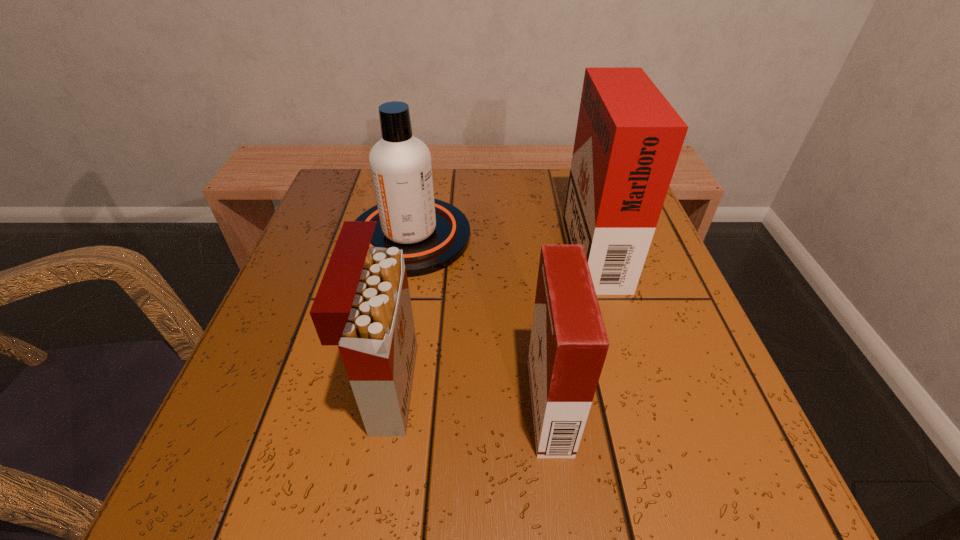
In the image, there is a desktop. Identify the location of vacant region at the far edge. (499, 168).

Where is `vacant area at the near edge`? vacant area at the near edge is located at coordinates (402, 465).

You are a GUI agent. You are given a task and a screenshot of the screen. Output one action in this format:
    pyautogui.click(x=<x>, y=<y>)
    Task: Click on the free location at the left edge of the desktop
    
    Given the screenshot: What is the action you would take?
    pyautogui.click(x=302, y=345)

Identify the location of blank space at the right edge of the desktop. This screenshot has width=960, height=540. point(689,319).

Locate an element on the screen. The height and width of the screenshot is (540, 960). free space at the far left corner is located at coordinates (347, 191).

You are a GUI agent. You are given a task and a screenshot of the screen. Output one action in this format:
    pyautogui.click(x=<x>, y=<y>)
    Task: Click on the vacant area at the near right corner
    This screenshot has height=540, width=960.
    Given the screenshot: What is the action you would take?
    pyautogui.click(x=703, y=502)

Where is `vacant area between the tallest cigarette_case and the cleansing agent`? Image resolution: width=960 pixels, height=540 pixels. vacant area between the tallest cigarette_case and the cleansing agent is located at coordinates (501, 240).

Where is `free space that is in between the leftmost cigarette_case and the tallest cigarette_case`? free space that is in between the leftmost cigarette_case and the tallest cigarette_case is located at coordinates (491, 315).

Identify the location of vacant point located between the tallest cigarette_case and the leftmost cigarette_case. (491, 315).

Identify the location of empty location between the leftmost cigarette_case and the third object from left to right. The image size is (960, 540). (469, 397).